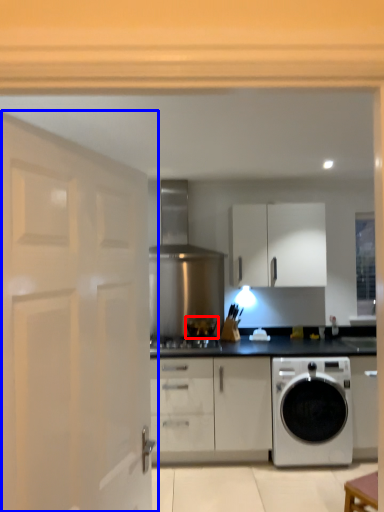
Question: Among these objects, which one is farthest to the camera, appliance (highlighted by a red box) or door (highlighted by a blue box)?

Choices:
 (A) appliance
 (B) door

Answer: (A)